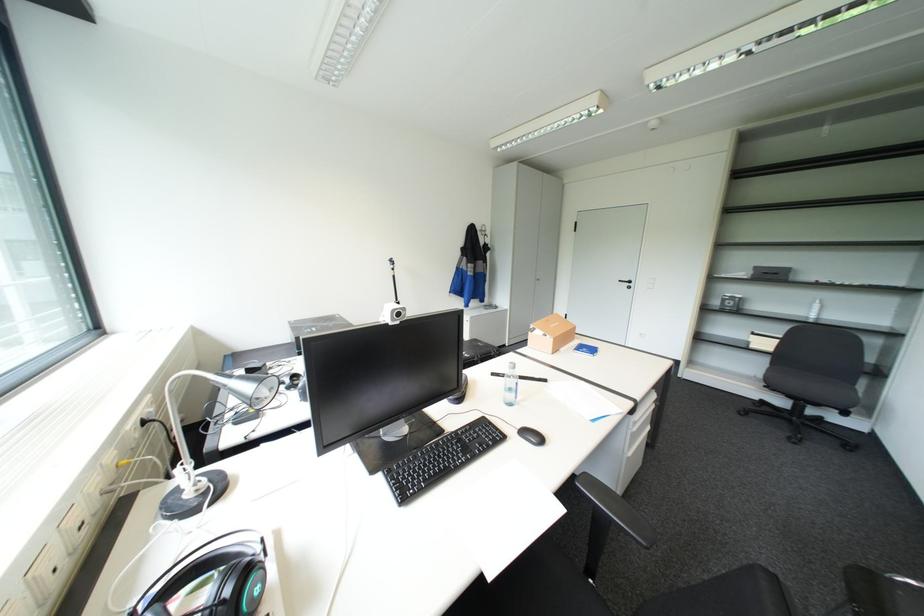
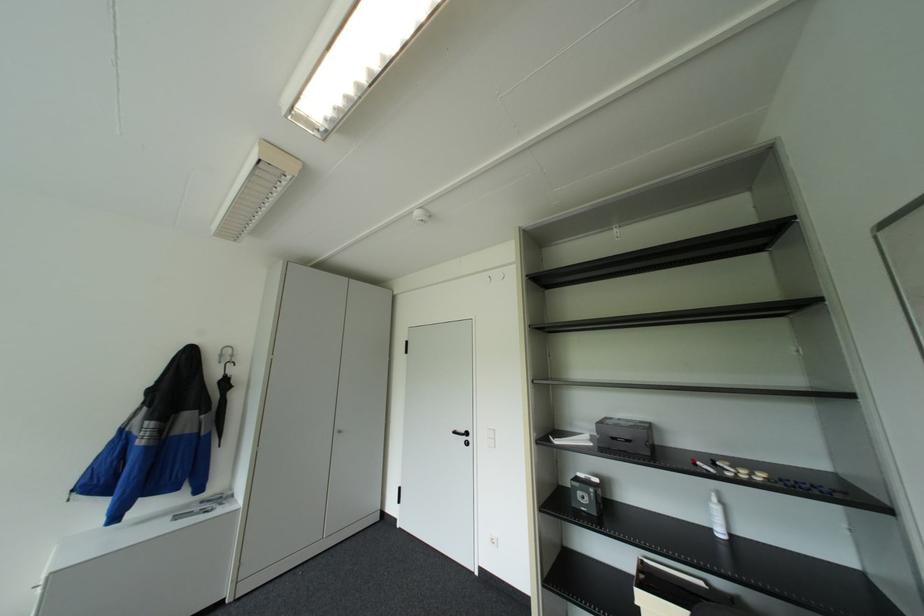
Find the pixel in the second image that matches pixel 628 280 in the first image.

(463, 431)